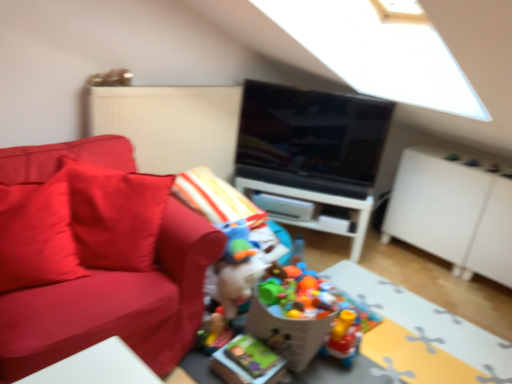
Question: In terms of height, does translucent plastic toy at center, marked as the second toy in a back-to-front arrangement, look taller or shorter compared to matte red pillow at left?

Choices:
 (A) short
 (B) tall

Answer: (A)

Question: From the image's perspective, is translucent plastic toy at center, marked as the second toy in a back-to-front arrangement, located above or below matte red pillow at left?

Choices:
 (A) below
 (B) above

Answer: (A)

Question: Estimate the real-world distances between objects in this image. Which object is closer to the plastic colorful toys at center, which is counted as the 3th toy, starting from the front?

Choices:
 (A) black glossy tv at center
 (B) white matte dresser at right
 (C) multicolored plastic toys at center, which is the third toy from back to front
 (D) translucent plastic toy at center, marked as the second toy in a back-to-front arrangement
 (E) matte red pillow at left

Answer: (C)

Question: Which object is the farthest from the white plastic table at center, the 1th table when ordered from top to bottom?

Choices:
 (A) matte red couch at left
 (B) plastic colorful toys at center, arranged as the 1th toy when viewed from the back
 (C) black glossy tv at center
 (D) white matte dresser at right
 (E) matte red pillow at left

Answer: (E)